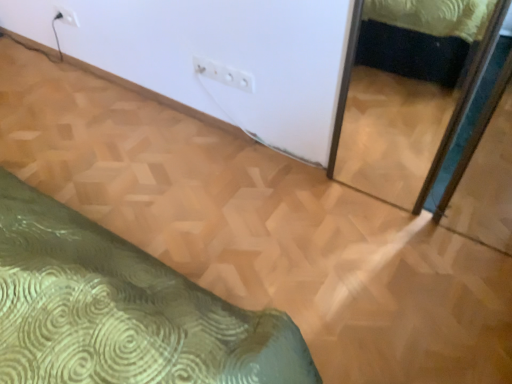
Question: From a real-world perspective, is white plastic electric outlet at upper center, placed as the second electric outlet when sorted from left to right, above or below white plastic electric outlet at upper left, which ranks as the 1th electric outlet in back-to-front order?

Choices:
 (A) below
 (B) above

Answer: (B)

Question: Considering the positions of point (251, 79) and point (55, 4), is point (251, 79) closer or farther from the camera than point (55, 4)?

Choices:
 (A) farther
 (B) closer

Answer: (B)

Question: Is white plastic electric outlet at upper center, which appears as the second electric outlet when viewed from the back, spatially inside white plastic electric outlet at upper left, which is the second electric outlet in front-to-back order, or outside of it?

Choices:
 (A) inside
 (B) outside

Answer: (B)

Question: Considering the positions of white plastic electric outlet at upper left, which is the second electric outlet in front-to-back order, and white plastic electric outlet at upper center, which appears as the second electric outlet when viewed from the back, in the image, is white plastic electric outlet at upper left, which is the second electric outlet in front-to-back order, bigger or smaller than white plastic electric outlet at upper center, which appears as the second electric outlet when viewed from the back,?

Choices:
 (A) small
 (B) big

Answer: (A)

Question: Is white plastic electric outlet at upper left, the second electric outlet when ordered from bottom to top, wider or thinner than white plastic electric outlet at upper center, the first electric outlet from the right?

Choices:
 (A) thin
 (B) wide

Answer: (A)

Question: Is point (70, 13) closer or farther from the camera than point (249, 82)?

Choices:
 (A) closer
 (B) farther

Answer: (B)

Question: In terms of height, does white plastic electric outlet at upper left, which appears as the 2th electric outlet when viewed from the right, look taller or shorter compared to white plastic electric outlet at upper center, which is the first electric outlet in bottom-to-top order?

Choices:
 (A) short
 (B) tall

Answer: (A)